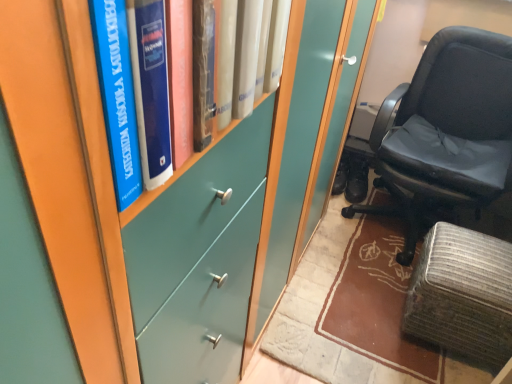
Question: Are black leather chair at right and blue hardcover book at left far apart?

Choices:
 (A) yes
 (B) no

Answer: (A)

Question: Considering the relative sizes of black leather chair at right and blue hardcover book at left in the image provided, is black leather chair at right bigger than blue hardcover book at left?

Choices:
 (A) yes
 (B) no

Answer: (A)

Question: From a real-world perspective, is black leather chair at right under blue hardcover book at left?

Choices:
 (A) no
 (B) yes

Answer: (B)

Question: Is black leather chair at right closer to camera compared to blue hardcover book at left?

Choices:
 (A) yes
 (B) no

Answer: (B)

Question: Does black leather chair at right appear on the left side of blue hardcover book at left?

Choices:
 (A) no
 (B) yes

Answer: (A)

Question: Can you confirm if black leather chair at right is thinner than blue hardcover book at left?

Choices:
 (A) no
 (B) yes

Answer: (A)

Question: Considering the relative sizes of blue hardcover book at left and black leather chair at right in the image provided, is blue hardcover book at left taller than black leather chair at right?

Choices:
 (A) no
 (B) yes

Answer: (A)

Question: Is blue hardcover book at left far from black leather chair at right?

Choices:
 (A) yes
 (B) no

Answer: (A)

Question: From the image's perspective, is blue hardcover book at left beneath black leather chair at right?

Choices:
 (A) yes
 (B) no

Answer: (A)

Question: Is black leather chair at right at the back of blue hardcover book at left?

Choices:
 (A) yes
 (B) no

Answer: (B)

Question: Is blue hardcover book at left wider than black leather chair at right?

Choices:
 (A) yes
 (B) no

Answer: (B)

Question: Does blue hardcover book at left have a smaller size compared to black leather chair at right?

Choices:
 (A) no
 (B) yes

Answer: (B)

Question: From the image's perspective, is textured gray ottoman at lower right on top of black leather chair at right?

Choices:
 (A) no
 (B) yes

Answer: (A)